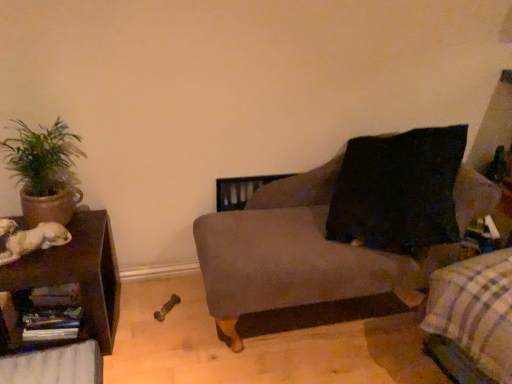
At what (x,y) coordinates should I click in order to perform the action: click on vacant area located to the right-hand side of wooden shelf at lower left. Please return your answer as a coordinate pair (x, y). Looking at the image, I should click on [x=129, y=325].